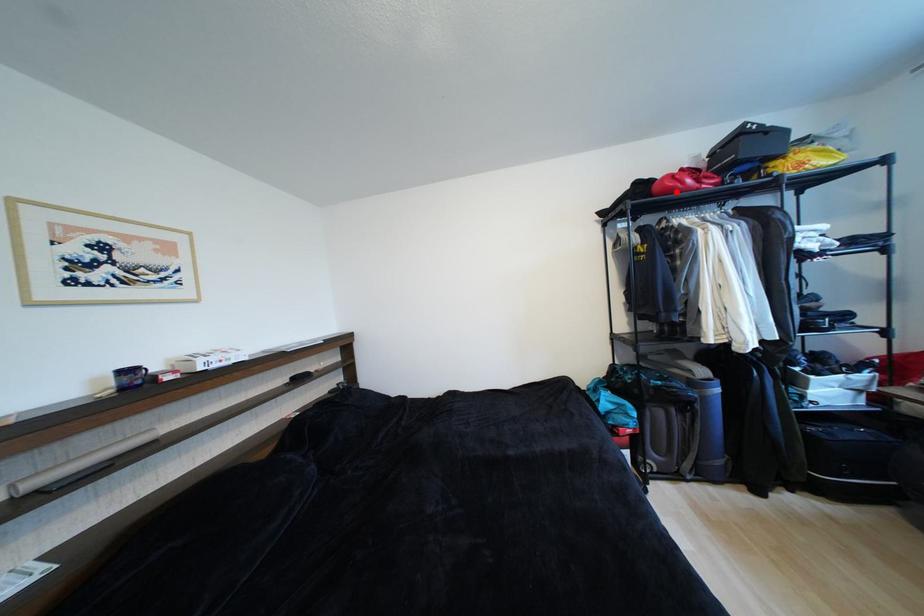
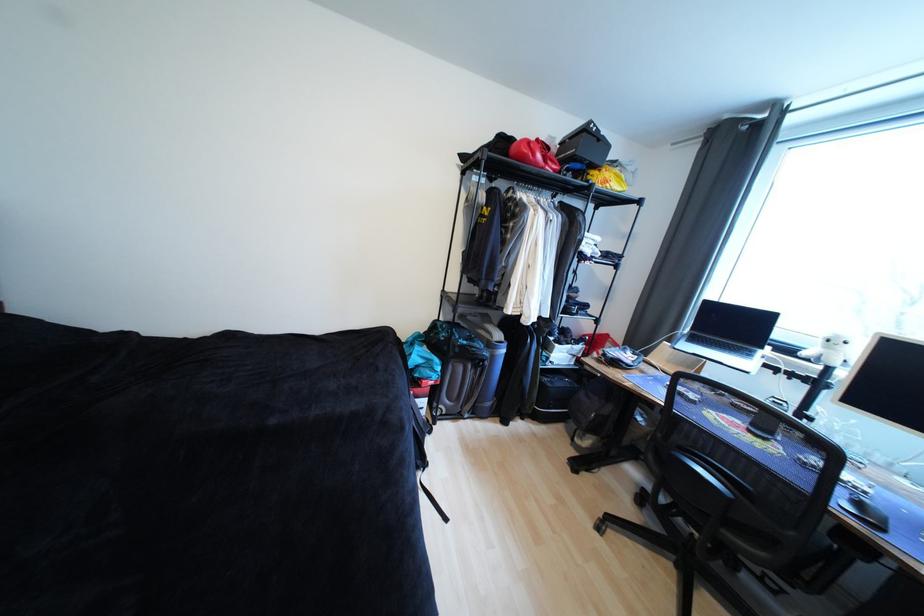
Find the pixel in the second image that matches the highlighted location in the first image.

(529, 159)